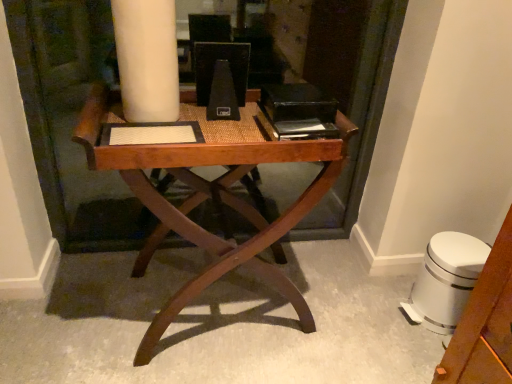
Image resolution: width=512 pixels, height=384 pixels. What do you see at coordinates (445, 280) in the screenshot? I see `white plastic swivel chair at lower right` at bounding box center [445, 280].

Where is `white plastic swivel chair at lower right`? The width and height of the screenshot is (512, 384). white plastic swivel chair at lower right is located at coordinates (445, 280).

The width and height of the screenshot is (512, 384). What do you see at coordinates (211, 192) in the screenshot?
I see `wooden desk at center` at bounding box center [211, 192].

At what (x,y) coordinates should I click in order to perform the action: click on wooden desk at center. Please return your answer as a coordinate pair (x, y). This screenshot has height=384, width=512. Looking at the image, I should click on (211, 192).

At what (x,y) coordinates should I click in order to perform the action: click on white plastic swivel chair at lower right. Please return your answer as a coordinate pair (x, y). Image resolution: width=512 pixels, height=384 pixels. Looking at the image, I should click on tap(445, 280).

Is wooden desk at center to the right of white plastic swivel chair at lower right from the viewer's perspective?

In fact, wooden desk at center is to the left of white plastic swivel chair at lower right.

Does wooden desk at center come behind white plastic swivel chair at lower right?

No, wooden desk at center is in front of white plastic swivel chair at lower right.

Is point (256, 240) positioned before point (421, 288)?

Yes, point (256, 240) is closer to viewer.

From the image's perspective, does wooden desk at center appear higher than white plastic swivel chair at lower right?

Yes.

From a real-world perspective, is wooden desk at center physically located above or below white plastic swivel chair at lower right?

wooden desk at center is situated higher than white plastic swivel chair at lower right in the real world.

Considering the sizes of objects wooden desk at center and white plastic swivel chair at lower right in the image provided, who is wider, wooden desk at center or white plastic swivel chair at lower right?

Wider between the two is wooden desk at center.

Is wooden desk at center taller than white plastic swivel chair at lower right?

Indeed, wooden desk at center has a greater height compared to white plastic swivel chair at lower right.

Who is bigger, wooden desk at center or white plastic swivel chair at lower right?

With larger size is wooden desk at center.

Is wooden desk at center surrounding white plastic swivel chair at lower right?

No, white plastic swivel chair at lower right is located outside of wooden desk at center.

Is the surface of wooden desk at center in direct contact with white plastic swivel chair at lower right?

They are not placed beside each other.

Is wooden desk at center aimed at white plastic swivel chair at lower right?

No, wooden desk at center is not oriented towards white plastic swivel chair at lower right.

The height and width of the screenshot is (384, 512). What are the coordinates of `swivel chair on the right side of wooden desk at center` in the screenshot? It's located at (445, 280).

Considering the relative positions of white plastic swivel chair at lower right and wooden desk at center in the image provided, is white plastic swivel chair at lower right to the left or to the right of wooden desk at center?

white plastic swivel chair at lower right is to the right of wooden desk at center.

Which object is closer to the camera taking this photo, white plastic swivel chair at lower right or wooden desk at center?

wooden desk at center is in front.

Which is less distant, (x=455, y=318) or (x=253, y=269)?

Point (x=455, y=318) is positioned farther from the camera compared to point (x=253, y=269).

From the image's perspective, does white plastic swivel chair at lower right appear higher than wooden desk at center?

No.

In the scene shown: From a real-world perspective, is white plastic swivel chair at lower right above or below wooden desk at center?

From a real-world perspective, white plastic swivel chair at lower right is physically below wooden desk at center.

Which of these two, white plastic swivel chair at lower right or wooden desk at center, is thinner?

With smaller width is white plastic swivel chair at lower right.

Is white plastic swivel chair at lower right taller than wooden desk at center?

No.

Is white plastic swivel chair at lower right bigger or smaller than wooden desk at center?

white plastic swivel chair at lower right is smaller than wooden desk at center.

Is wooden desk at center located within white plastic swivel chair at lower right?

No, wooden desk at center is located outside of white plastic swivel chair at lower right.

Is white plastic swivel chair at lower right far from wooden desk at center?

That's not correct — white plastic swivel chair at lower right is a little close to wooden desk at center.

Is white plastic swivel chair at lower right aimed at wooden desk at center?

Answer: Yes, white plastic swivel chair at lower right faces towards wooden desk at center.

From the picture: What's the angular difference between white plastic swivel chair at lower right and wooden desk at center's facing directions?

The facing directions of white plastic swivel chair at lower right and wooden desk at center are 94.1 degrees apart.

Where is `desk that is in front of the white plastic swivel chair at lower right`? desk that is in front of the white plastic swivel chair at lower right is located at coordinates point(211,192).

Where is `desk above the white plastic swivel chair at lower right (from the image's perspective)`? desk above the white plastic swivel chair at lower right (from the image's perspective) is located at coordinates (211, 192).

In the image, there is a wooden desk at center. Where is `swivel chair below it (from a real-world perspective)`? The width and height of the screenshot is (512, 384). swivel chair below it (from a real-world perspective) is located at coordinates (445, 280).